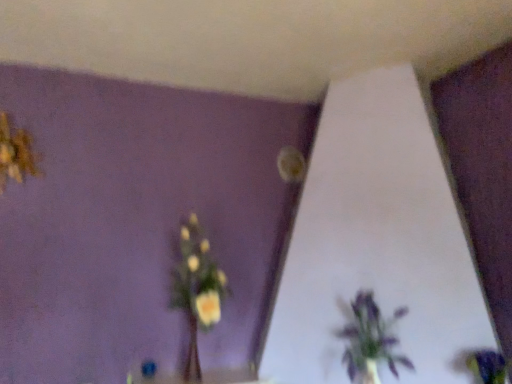
Question: Relative to yellow fabric flower at upper left, which appears as the third flower when ordered from the bottom, is purple matte flower at lower right, the 3th flower viewed from the back, in front or behind?

Choices:
 (A) behind
 (B) front

Answer: (B)

Question: From a real-world perspective, is purple matte flower at lower right, placed as the 3th flower when sorted from top to bottom, physically located above or below yellow fabric flower at upper left, which is the first flower from left to right?

Choices:
 (A) below
 (B) above

Answer: (A)

Question: Which is nearer to the purple matte flower at lower right, positioned as the third flower in left-to-right order?

Choices:
 (A) yellow matte vase at center
 (B) matte yellow flower at upper center, which is the first flower in back-to-front order
 (C) yellow fabric flower at upper left, the 2th flower when ordered from back to front
 (D) purple matte plant at lower right

Answer: (D)

Question: Estimate the real-world distances between objects in this image. Which object is farther from the purple matte plant at lower right?

Choices:
 (A) matte yellow flower at upper center, which appears as the second flower when viewed from the top
 (B) purple matte flower at lower right, the 3th flower viewed from the back
 (C) yellow matte vase at center
 (D) yellow fabric flower at upper left, which ranks as the 1th flower in top-to-bottom order

Answer: (D)